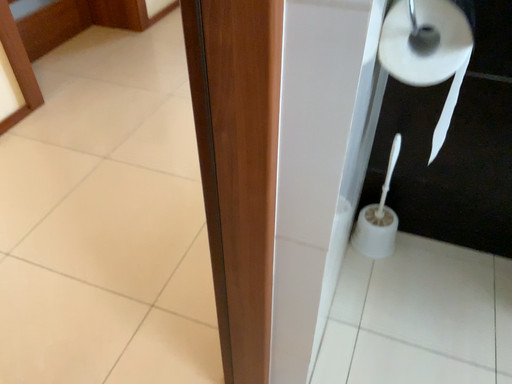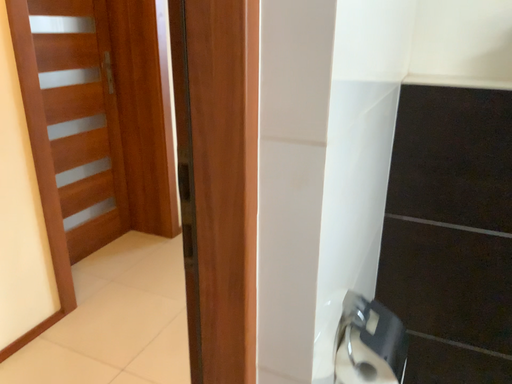
Question: How did the camera likely rotate when shooting the video?

Choices:
 (A) rotated downward
 (B) rotated upward

Answer: (B)